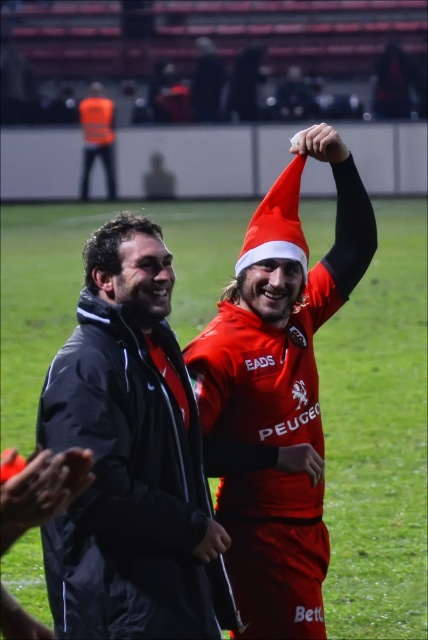
You are standing at the origin point in the image and want to throw a ball to the point labeled as point (305, 145). However, there is another point labeled as point (109, 113) in your way. Will the ball pass through the second point before reaching the target?

Point (109, 113) is behind point (305, 145), so the ball will not pass through the second point before reaching the target.

You are a photographer standing in the middle of the field. You want to take a photo of the matte red santa hat at upper center without the orange reflective vest at upper left blocking it. Is this possible?

The orange reflective vest at upper left is positioned over matte red santa hat at upper center, so it will block the view of the matte red santa hat at upper center. Therefore, you cannot take a photo of the matte red santa hat at upper center without the orange reflective vest at upper left blocking it.

Based on the photo, you are a photographer trying to capture a closeup of the matte black arm at upper center and the matte black glove at center. Which object should you focus on first if you want to ensure both are in focus?

The matte black arm at upper center is positioned on the right side of the matte black glove at center, so focusing on the matte black glove at center first will ensure both are in focus as they are close to each other.